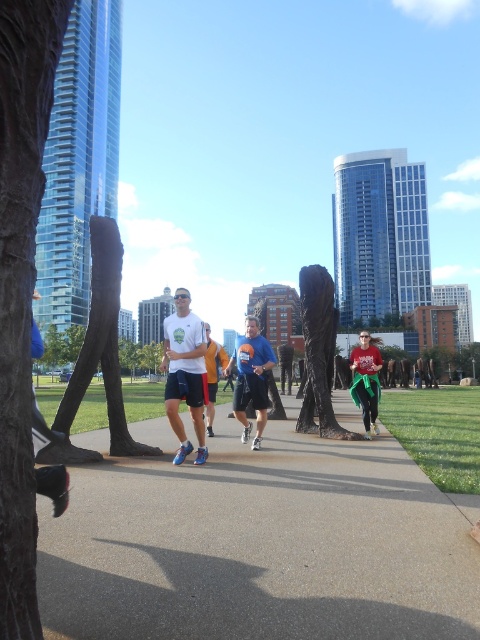
Question: Can you confirm if matte white t-shirt at center is wider than blue fabric shirt at center?

Choices:
 (A) no
 (B) yes

Answer: (B)

Question: Which point is closer to the camera?

Choices:
 (A) blue fabric shirt at center
 (B) matte green skirt at center
 (C) orange fabric shorts at center

Answer: (C)

Question: Which of the following is the closest to the observer?

Choices:
 (A) (188, 392)
 (B) (359, 346)
 (C) (207, 412)
 (D) (63, 572)

Answer: (D)

Question: Which point is farther to the camera?

Choices:
 (A) (365, 381)
 (B) (186, 296)
 (C) (261, 356)

Answer: (A)

Question: Can you confirm if blue fabric shirt at center is thinner than orange fabric shorts at center?

Choices:
 (A) yes
 (B) no

Answer: (B)

Question: Can you confirm if blue fabric shirt at center is positioned below matte green skirt at center?

Choices:
 (A) yes
 (B) no

Answer: (B)